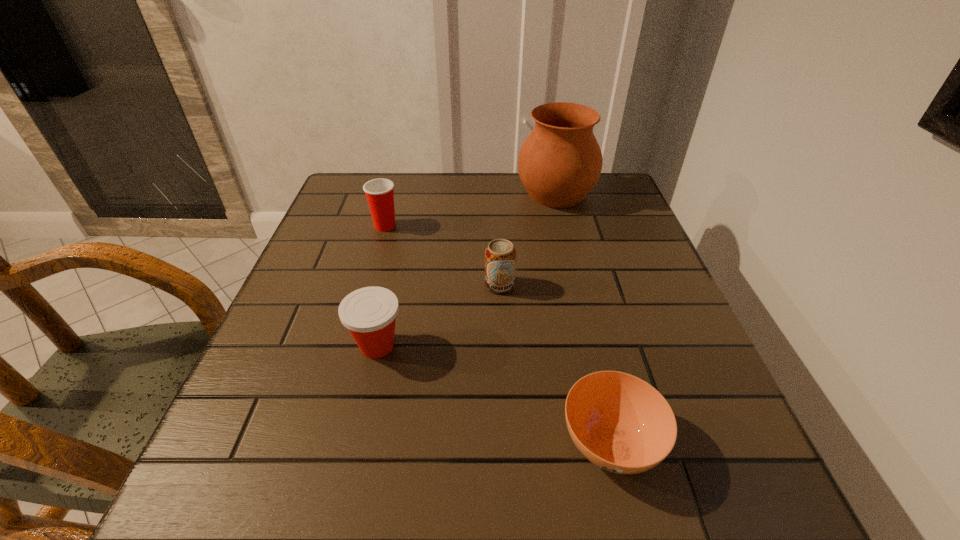
Locate an element on the screen. The image size is (960, 540). vacant area at the far edge of the desktop is located at coordinates (511, 176).

Identify the location of vacant position at the near edge of the desktop. The width and height of the screenshot is (960, 540). (370, 528).

Where is `vacant space at the left edge of the desktop`? vacant space at the left edge of the desktop is located at coordinates (320, 272).

Locate an element on the screen. blank space at the right edge is located at coordinates (681, 345).

In the image, there is a desktop. Identify the location of blank space at the far left corner. (332, 202).

Image resolution: width=960 pixels, height=540 pixels. I want to click on free location at the near left corner of the desktop, so click(x=294, y=484).

I want to click on vacant position at the far right corner of the desktop, so click(x=588, y=195).

The height and width of the screenshot is (540, 960). In the image, there is a desktop. Find the location of `blank space at the near right corner`. blank space at the near right corner is located at coordinates (706, 486).

Locate an element on the screen. The width and height of the screenshot is (960, 540). free spot between the pottery and the nearest object is located at coordinates (583, 318).

Find the location of `empty space that is in between the nearer Dixie cup and the fourth nearest object`. empty space that is in between the nearer Dixie cup and the fourth nearest object is located at coordinates (381, 286).